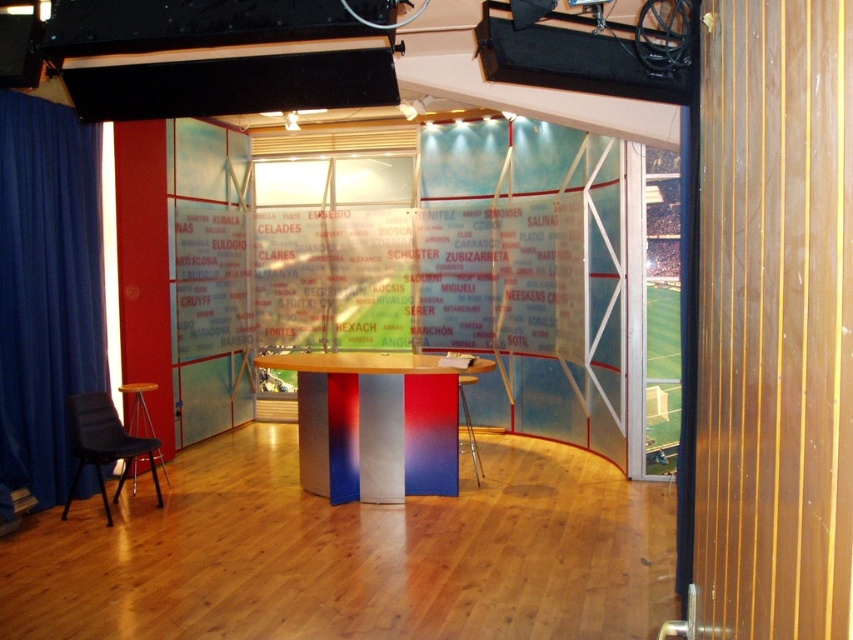
You are a guest commentator preparing to join a live broadcast. You need to sit down at the metallic stool at center and place your notes on the metallic gradient table at center. Can you comfortably do this without needing to adjust your seating position?

The metallic gradient table at center is taller than the metallic stool at center, so you can comfortably sit at the metallic stool at center and place your notes on the metallic gradient table at center without needing to adjust your seating position.

You are a guest speaker who needs to sit comfortably during a live broadcast. You have to choose between the black fabric chair at lower left and the metallic stool at center. Which one would be more comfortable for a longer duration?

The black fabric chair at lower left is larger in size than the metallic stool at center, so it would likely be more comfortable for a longer duration due to its larger seating area providing better support.

You are a guest arriving at the studio and need to sit down. There is a black fabric chair at lower left and a metallic stool at center. Which one is closer to the entrance of the studio?

The black fabric chair at lower left is closer to the entrance of the studio because it is positioned to the left of the metallic stool at center, which is further away from the entrance.